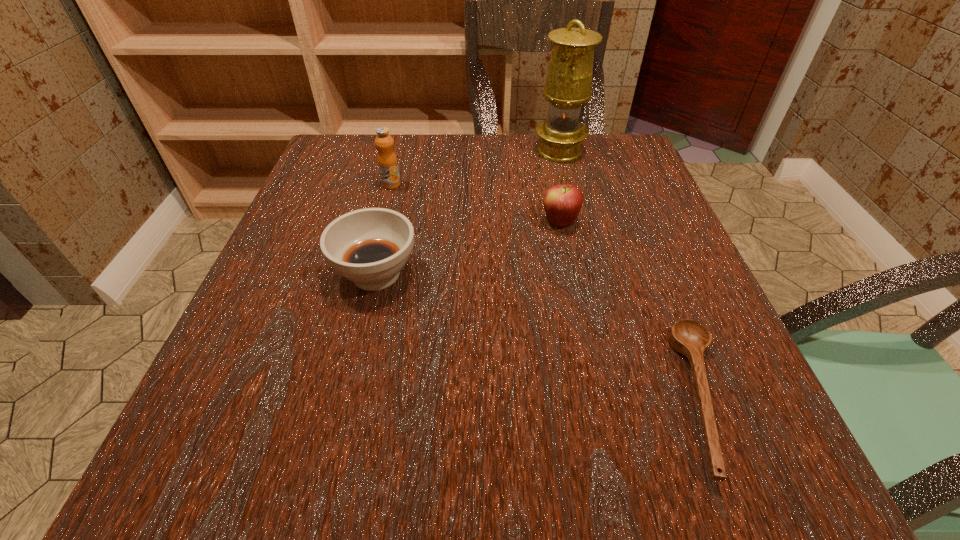
The height and width of the screenshot is (540, 960). I want to click on free space between the apple and the shortest object, so click(x=631, y=310).

Locate an element on the screen. The image size is (960, 540). empty space that is in between the fourth nearest object and the third farthest object is located at coordinates (475, 204).

Locate an element on the screen. vacant area between the shortest object and the fourth tallest object is located at coordinates (539, 336).

This screenshot has width=960, height=540. What are the coordinates of `vacant space in between the tallest object and the fourth nearest object` in the screenshot? It's located at (475, 168).

Find the location of `vacant area between the fourth nearest object and the third farthest object`. vacant area between the fourth nearest object and the third farthest object is located at coordinates (475, 204).

You are a GUI agent. You are given a task and a screenshot of the screen. Output one action in this format:
    pyautogui.click(x=<x>, y=<y>)
    Task: Click on the vacant area between the fourth farthest object and the tallest object
    
    Given the screenshot: What is the action you would take?
    pyautogui.click(x=468, y=213)

The height and width of the screenshot is (540, 960). What are the coordinates of `free space between the oil lamp and the wooden spoon` in the screenshot? It's located at (631, 274).

Find the location of a particular element. This screenshot has height=540, width=960. empty space that is in between the oil lamp and the orange juice is located at coordinates (475, 168).

Identify the location of object that stands as the closest to the second farthest object. (370, 246).

Locate which object is the second closest to the oil lamp. Please provide its 2D coordinates. Your answer should be formatted as a tuple, i.e. [(x, y)], where the tuple contains the x and y coordinates of a point satisfying the conditions above.

[(387, 161)]